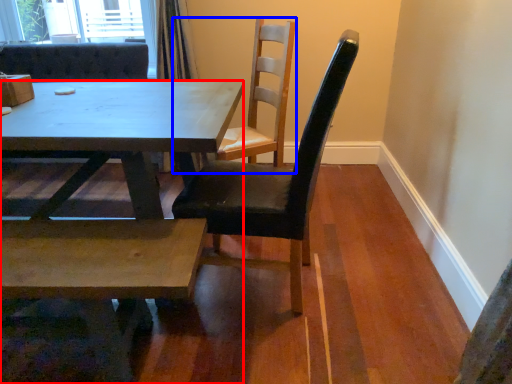
Question: Which object appears closest to the camera in this image, kitchen & dining room table (highlighted by a red box) or chair (highlighted by a blue box)?

Choices:
 (A) kitchen & dining room table
 (B) chair

Answer: (A)